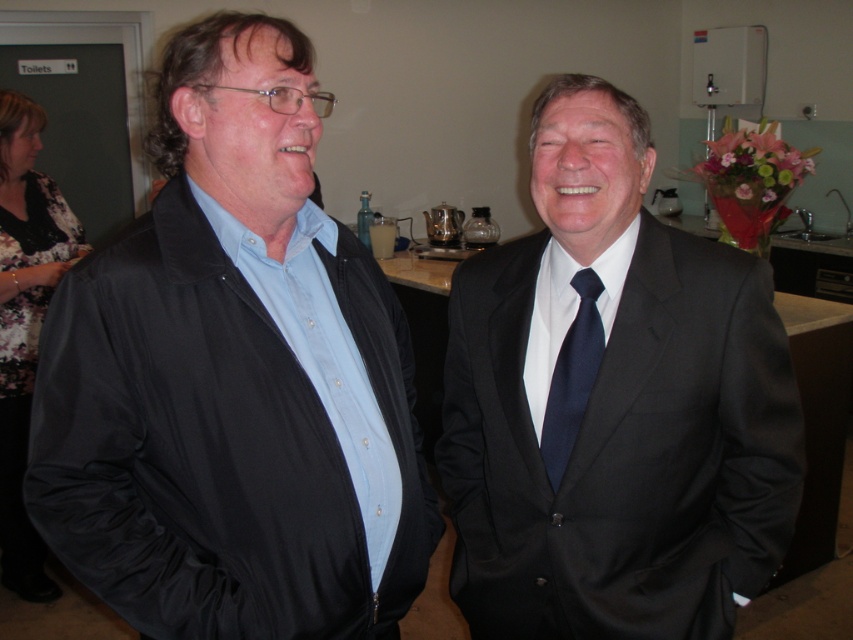
Can you confirm if matte black jacket at left is positioned below floral print fabric dress at left?

Incorrect, matte black jacket at left is not positioned below floral print fabric dress at left.

Does matte black jacket at left have a lesser width compared to floral print fabric dress at left?

Incorrect, matte black jacket at left's width is not less than floral print fabric dress at left's.

Does point (405, 401) lie in front of point (18, 340)?

That is True.

You are a GUI agent. You are given a task and a screenshot of the screen. Output one action in this format:
    pyautogui.click(x=<x>, y=<y>)
    Task: Click on the matte black jacket at left
    This screenshot has height=640, width=853.
    Given the screenshot: What is the action you would take?
    pyautogui.click(x=233, y=378)

Is satin black suit at right further to camera compared to navy blue silk tie at center?

No, satin black suit at right is closer to the viewer.

Does satin black suit at right come in front of navy blue silk tie at center?

Yes, satin black suit at right is in front of navy blue silk tie at center.

Is point (646, 417) positioned before point (579, 412)?

Yes, point (646, 417) is closer to viewer.

Identify the location of satin black suit at right. (612, 403).

Can you confirm if matte black jacket at left is bigger than satin black suit at right?

Yes, matte black jacket at left is bigger than satin black suit at right.

Does matte black jacket at left come behind satin black suit at right?

No, it is in front of satin black suit at right.

Between point (126, 378) and point (788, 509), which one is positioned behind?

The point (788, 509) is behind.

Identify the location of matte black jacket at left. (233, 378).